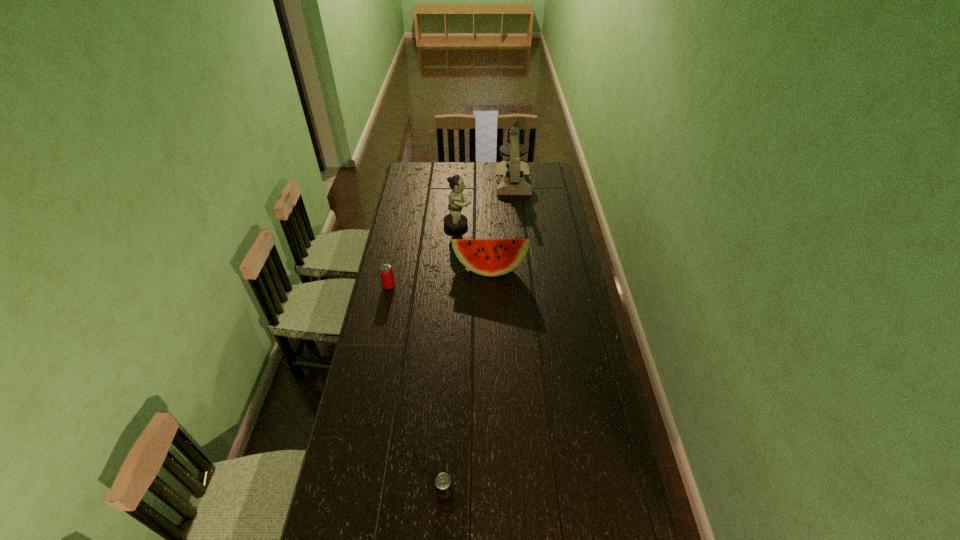
Identify the location of object that stands as the third closest to the third shortest object. This screenshot has height=540, width=960. (512, 177).

The image size is (960, 540). I want to click on the fourth closest object to the nearest object, so click(512, 177).

The image size is (960, 540). Find the location of `beer can object that ranks as the second closest to the fourth nearest object`. beer can object that ranks as the second closest to the fourth nearest object is located at coordinates (443, 483).

This screenshot has height=540, width=960. What are the coordinates of `beer can that is the closest to the tallest object` in the screenshot? It's located at (387, 277).

The width and height of the screenshot is (960, 540). Identify the location of vacant point that satisfies the following two spatial constraints: 1. on the front-facing side of the nearer beer can; 2. on the right side of the second farthest object. (442, 496).

This screenshot has height=540, width=960. Find the location of `free space that satisfies the following two spatial constraints: 1. on the front-facing side of the second tallest object; 2. on the left side of the nearer beer can`. free space that satisfies the following two spatial constraints: 1. on the front-facing side of the second tallest object; 2. on the left side of the nearer beer can is located at coordinates (442, 496).

This screenshot has width=960, height=540. I want to click on free region that satisfies the following two spatial constraints: 1. on the front side of the left beer can; 2. on the left side of the nearest object, so click(346, 496).